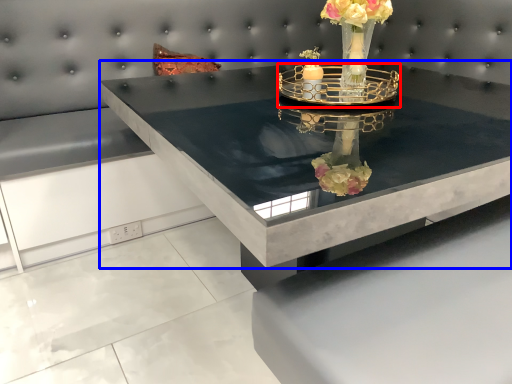
Question: Which point is further to the camera, candle holder (highlighted by a red box) or table (highlighted by a blue box)?

Choices:
 (A) candle holder
 (B) table

Answer: (A)